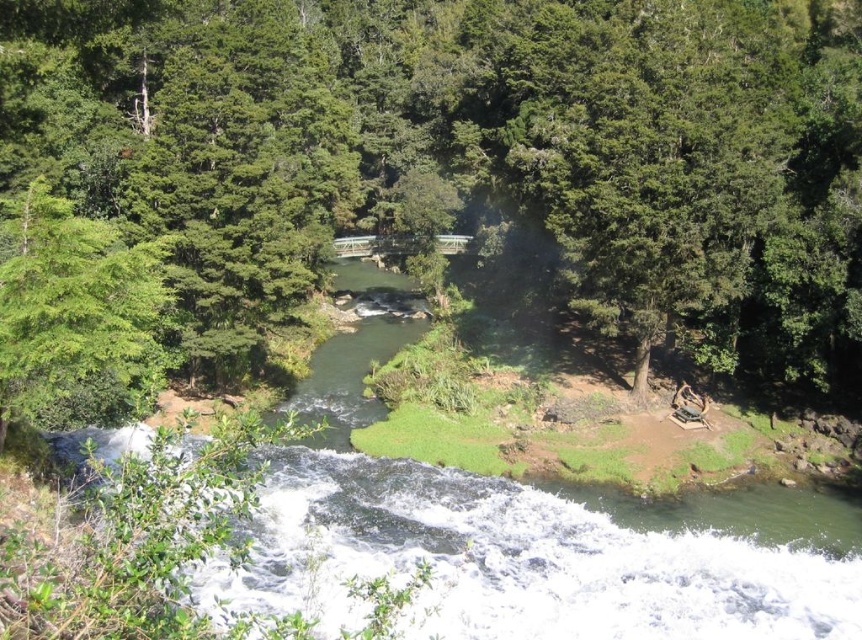
You are standing at the origin point in the image. Which direction should you walk to reach the green leafy tree at center?

The green leafy tree at center is located at coordinates 0.234 in the x direction and 0.553 in the y direction. Therefore, you should walk to the right and forward to reach it.

You are a hiker planning to set up a campsite between the green leafy tree at center and the green leafy tree at left. The recommended safe distance between trees for tents is at least 20 meters to avoid falling branches. Based on the scene, is this location suitable?

The distance between the green leafy tree at center and the green leafy tree at left is 19.22 meters, which is less than the recommended 20 meters. Therefore, this location is not suitable for setting up a campsite between them due to the insufficient distance.

You are a hiker who needs to cross the river. You see two trees, the green leafy tree at center and the green leafy tree at upper right. Which tree is closer to the river?

Both trees are located in the middle ground of the scene, away from the river in the foreground. Neither tree is near the river, so you cannot use them to cross.